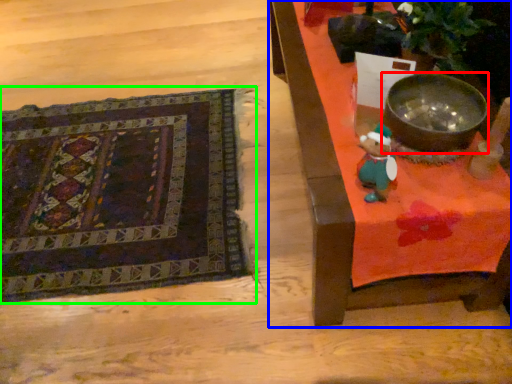
Question: Estimate the real-world distances between objects in this image. Which object is farther from mixing bowl (highlighted by a red box), furniture (highlighted by a blue box) or mat (highlighted by a green box)?

Choices:
 (A) furniture
 (B) mat

Answer: (B)